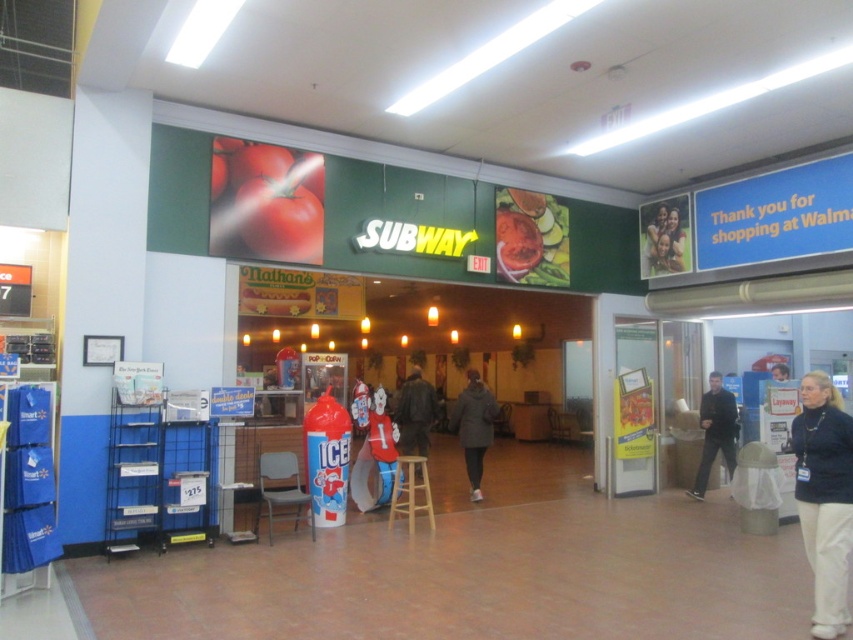
You are a customer standing at the entrance of the Walmart food court and see the black fabric pants at lower right and the dark blue jacket at lower right. You want to walk to the Subway sandwich shop located in the center. Which item of clothing should you pass closer to while walking towards the Subway?

Since the black fabric pants at lower right is 20.25 feet away from dark blue jacket at lower right, you should pass closer to the dark blue jacket at lower right because it is nearer to the Subway sandwich shop in the center compared to the black fabric pants at lower right.

You are a store employee who needs to hang two jackets in the Walmart store. The dark brown leather jacket at center and the dark blue jacket at lower right. The store has a rack that can only hold one large jacket. Which jacket should you place on the rack?

The dark brown leather jacket at center has a larger size compared to the dark blue jacket at lower right, so you should place the dark brown leather jacket at center on the rack since it is the larger one.